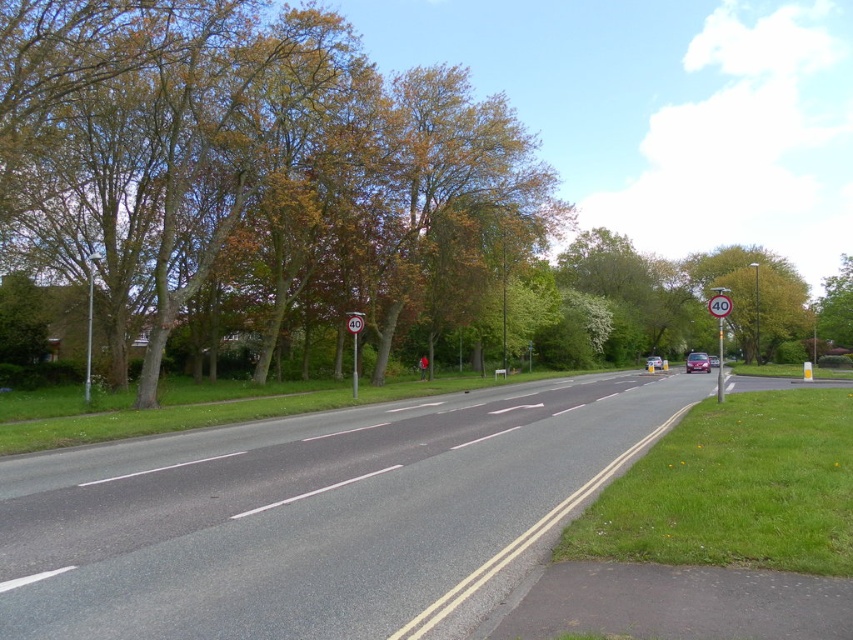
You are standing at the camera position and want to cross the road to reach the metallic red car at center. The road is 30 feet wide. Can you safely cross the road before the car reaches you if you start walking now?

The metallic red car at center and camera are 202.16 feet apart from each other. Since the road is 30 feet wide, you can safely cross before the car arrives as the distance between you and the car is much greater than the road width.

You are driving a car and see the brown leafy tree at upper left and the red plastic speed limit sign at center. Which object is closer to you?

The brown leafy tree at upper left is closer to you because it is in front of the red plastic speed limit sign at center.